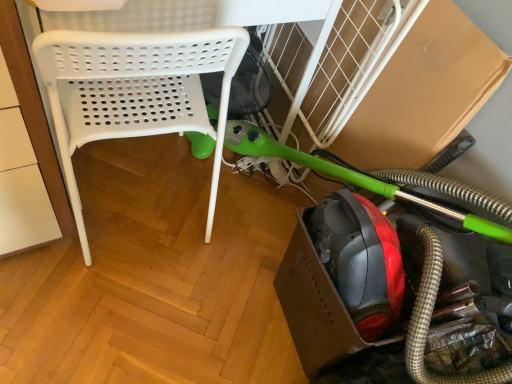
The image size is (512, 384). What are the coordinates of `free space in front of white plastic chair at left` in the screenshot? It's located at (102, 308).